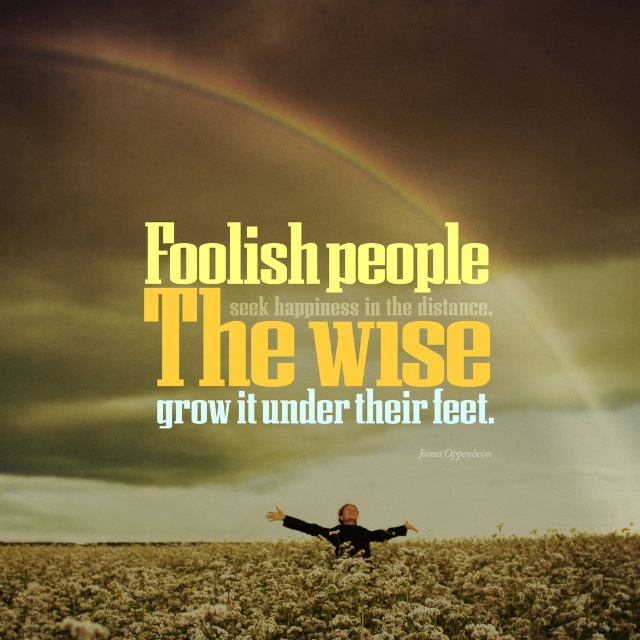
Question: Is white fluffy flowers at lower center bigger than black matte arm at lower center?

Choices:
 (A) yes
 (B) no

Answer: (A)

Question: Observing the image, what is the correct spatial positioning of golden hair person at center in reference to black matte arm at lower center?

Choices:
 (A) above
 (B) below

Answer: (B)

Question: Which object appears farthest from the camera in this image?

Choices:
 (A) golden hair person at center
 (B) white fluffy flowers at lower center
 (C) smooth black arm at center

Answer: (C)

Question: Is white fluffy flowers at lower center thinner than smooth black arm at center?

Choices:
 (A) no
 (B) yes

Answer: (A)

Question: Estimate the real-world distances between objects in this image. Which object is closer to the smooth black arm at center?

Choices:
 (A) golden hair person at center
 (B) white fluffy flowers at lower center

Answer: (A)

Question: Which object is the closest to the golden hair person at center?

Choices:
 (A) smooth black arm at center
 (B) black matte arm at lower center
 (C) white fluffy flowers at lower center

Answer: (A)